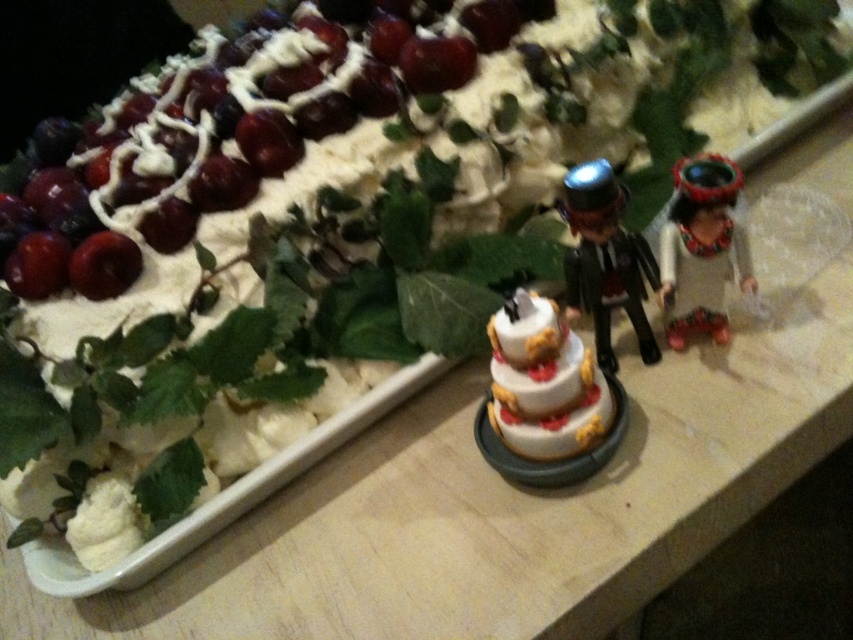
Is white matte tiered cake at center to the right of shiny black toy at center from the viewer's perspective?

No, white matte tiered cake at center is not to the right of shiny black toy at center.

Does white matte tiered cake at center have a smaller size compared to shiny black toy at center?

Yes, white matte tiered cake at center is smaller than shiny black toy at center.

Is point (579, 392) positioned behind point (569, 272)?

No, (579, 392) is closer to viewer.

The image size is (853, 640). I want to click on white matte tiered cake at center, so click(x=544, y=381).

How far apart are shiny plastic bride at right and shiny red cherry at upper left?

shiny plastic bride at right and shiny red cherry at upper left are 58.83 centimeters apart from each other.

Does shiny plastic bride at right have a lesser height compared to shiny red cherry at upper left?

No, shiny plastic bride at right is not shorter than shiny red cherry at upper left.

Which is in front, point (701, 248) or point (138, 262)?

Point (701, 248) is more forward.

Locate an element on the screen. shiny plastic bride at right is located at coordinates (701, 248).

Can you confirm if shiny black toy at center is smaller than shiny red cherry at upper left?

Actually, shiny black toy at center might be larger than shiny red cherry at upper left.

Which is more to the right, shiny black toy at center or shiny red cherry at upper left?

shiny black toy at center is more to the right.

Which is behind, point (621, 188) or point (103, 237)?

The point (103, 237) is more distant.

This screenshot has width=853, height=640. I want to click on shiny black toy at center, so click(605, 259).